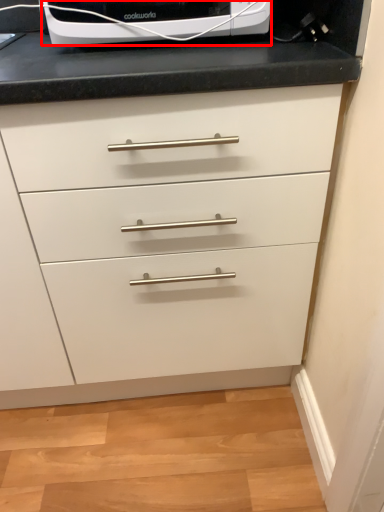
Question: Observing the image, what is the correct spatial positioning of home appliance (annotated by the red box) in reference to chest of drawers?

Choices:
 (A) right
 (B) left

Answer: (A)